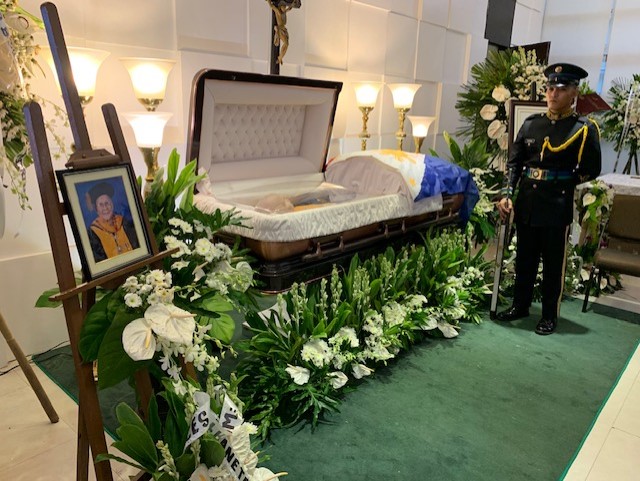
The image size is (640, 481). In order to click on picture in this screenshot , I will do `click(116, 234)`.